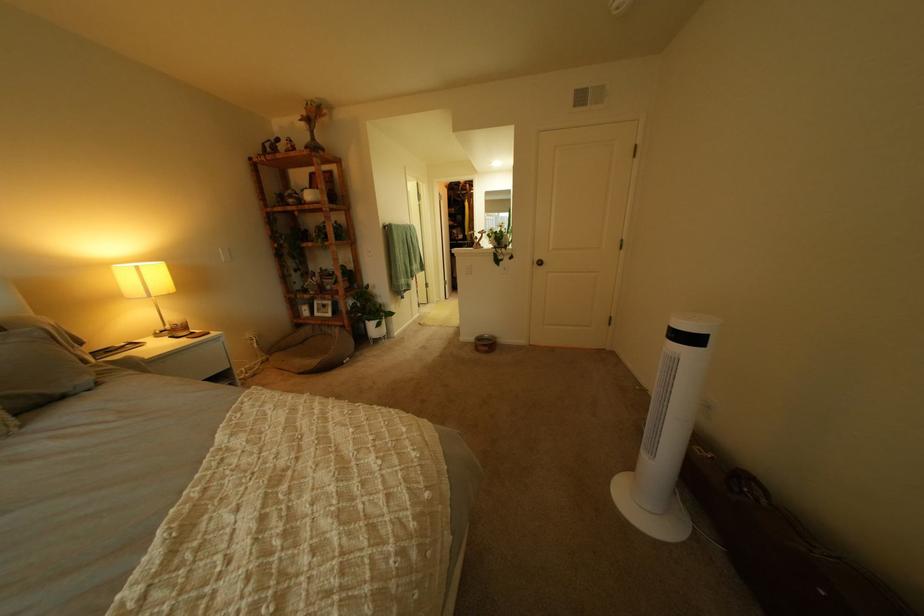
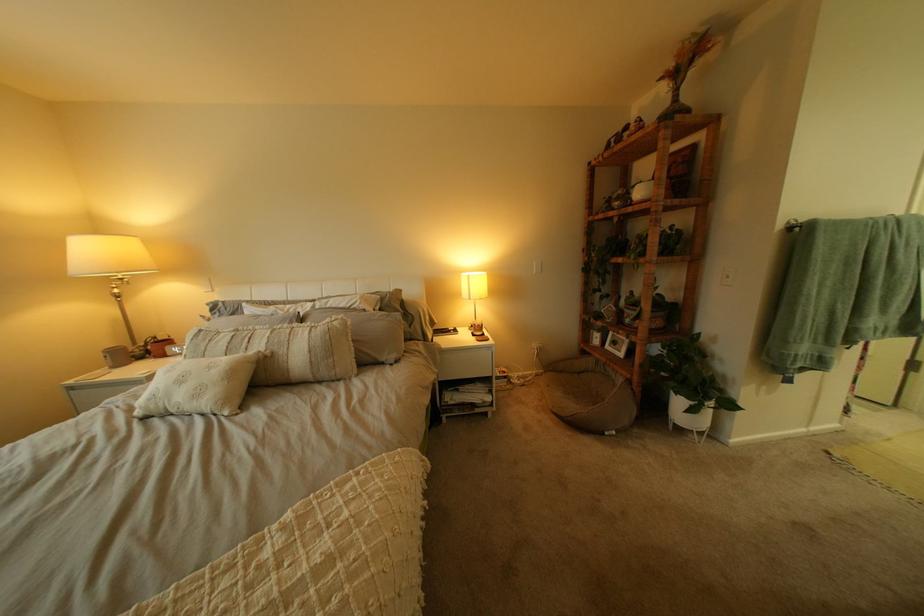
Locate, in the second image, the point that corresponds to pixel 381 318 in the first image.

(687, 385)